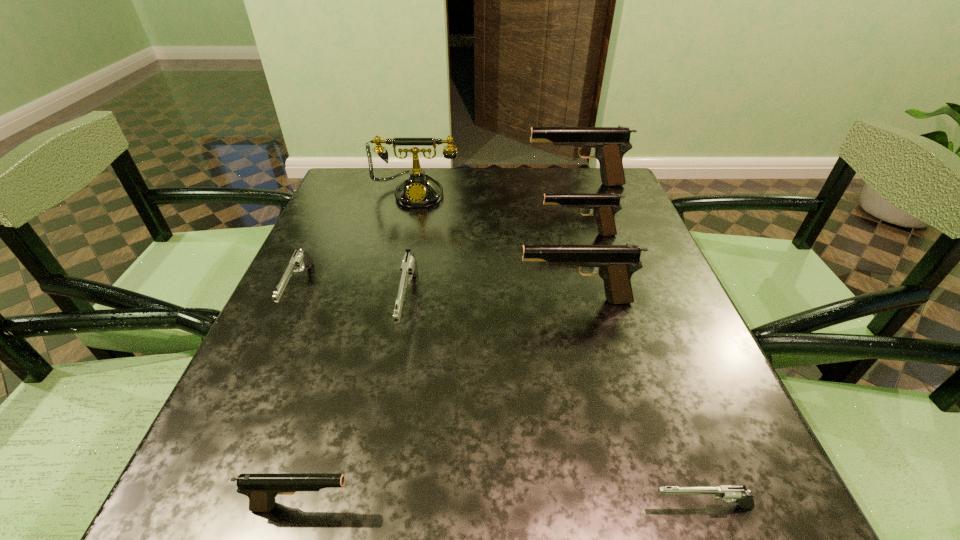
Identify the location of vacant space situated 0.090m on the front-facing side of the shortest pistol. This screenshot has height=540, width=960. (582, 507).

Locate an element on the screen. telephone present at the far edge is located at coordinates (417, 190).

At what (x,y) coordinates should I click in order to perform the action: click on pistol that is at the far edge. Please return your answer as a coordinate pair (x, y). Looking at the image, I should click on (610, 144).

At what (x,y) coordinates should I click in order to perform the action: click on telephone located in the left edge section of the desktop. Please return your answer as a coordinate pair (x, y). Looking at the image, I should click on (417, 190).

Where is `object that is at the far left corner`? The height and width of the screenshot is (540, 960). object that is at the far left corner is located at coordinates (417, 190).

Find the location of a particular element. This screenshot has height=540, width=960. object present at the near left corner is located at coordinates (261, 489).

What are the coordinates of `object that is at the far right corner` in the screenshot? It's located at coord(610,144).

Find the location of a particular element. This screenshot has height=540, width=960. object situated at the near right corner is located at coordinates (728, 493).

In the image, there is a desktop. At what (x,y) coordinates should I click in order to perform the action: click on vacant space at the far edge. Please return your answer as a coordinate pair (x, y). This screenshot has height=540, width=960. Looking at the image, I should click on [556, 177].

In the image, there is a desktop. Find the location of `free space at the near edge`. free space at the near edge is located at coordinates (511, 468).